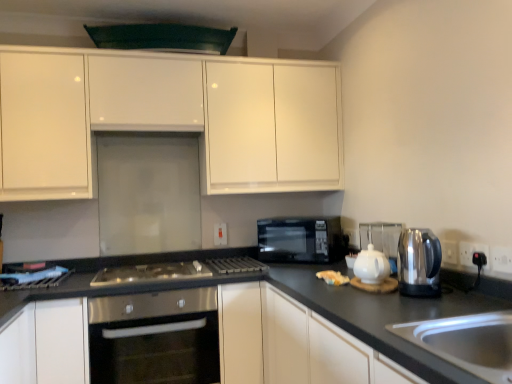
Where is `vacant space that's between white glossy teapot at center-right and stainless steel kettle at right`? This screenshot has width=512, height=384. vacant space that's between white glossy teapot at center-right and stainless steel kettle at right is located at coordinates (393, 301).